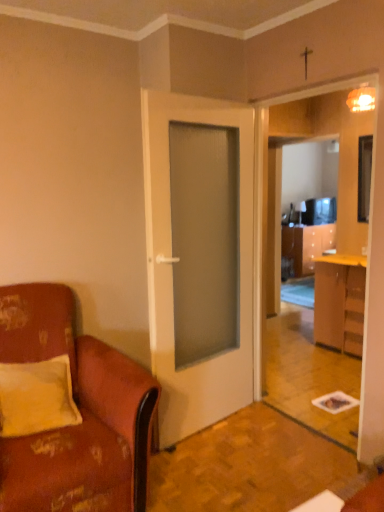
In order to click on unoccupied region to the right of white matte door at center in this screenshot , I will do `click(272, 437)`.